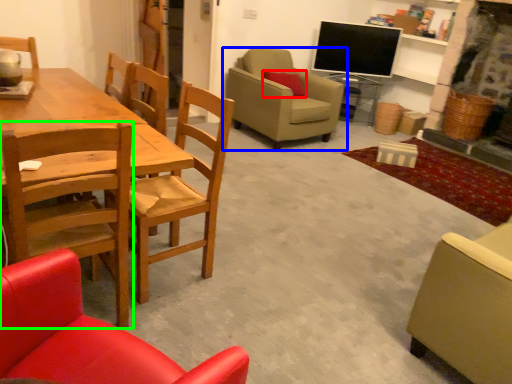
Question: Which object is positioned closest to pillow (highlighted by a red box)? Select from chair (highlighted by a blue box) and chair (highlighted by a green box).

Choices:
 (A) chair
 (B) chair

Answer: (A)